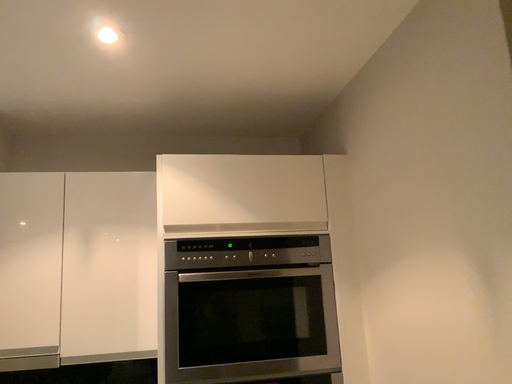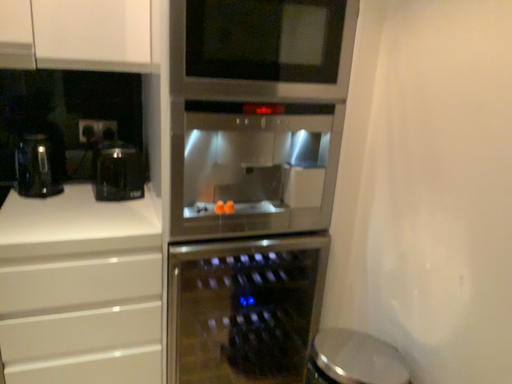
Question: How did the camera likely rotate when shooting the video?

Choices:
 (A) rotated upward
 (B) rotated downward

Answer: (B)